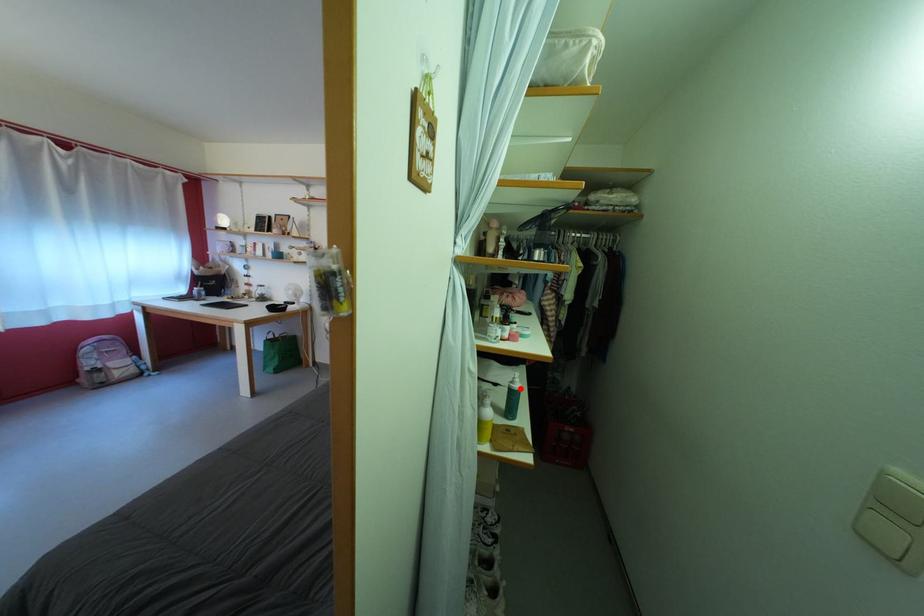
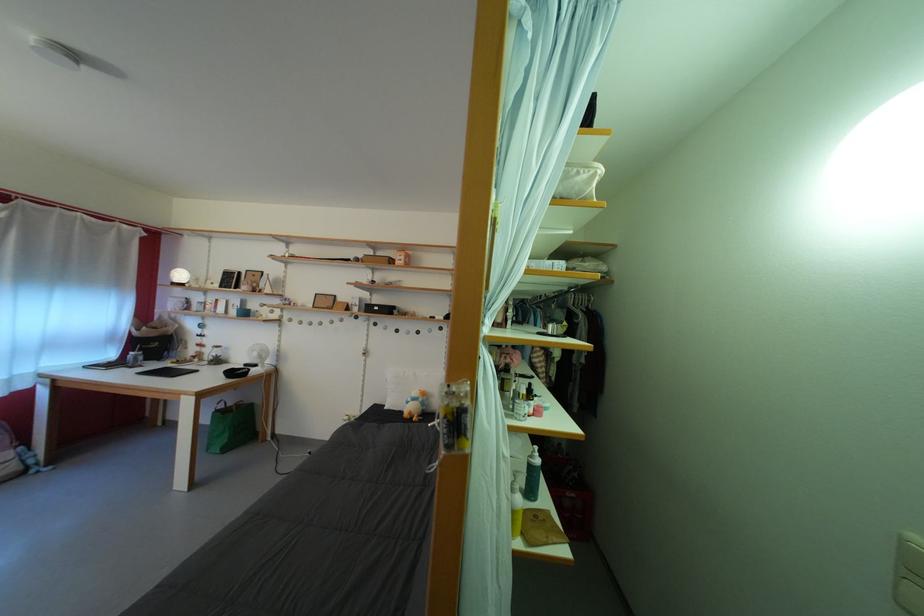
The point at the highlighted location is marked in the first image. Where is the corresponding point in the second image?

(540, 463)